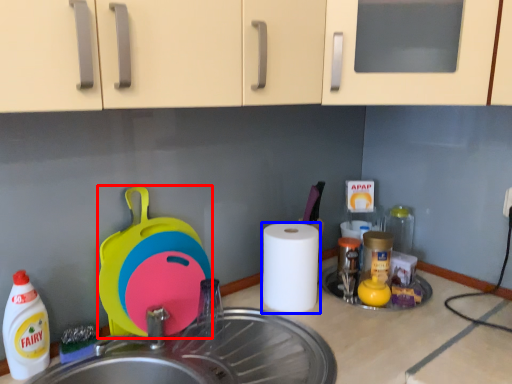
Question: Which object appears farthest to the camera in this image, appliance (highlighted by a red box) or paper towel (highlighted by a blue box)?

Choices:
 (A) appliance
 (B) paper towel

Answer: (B)